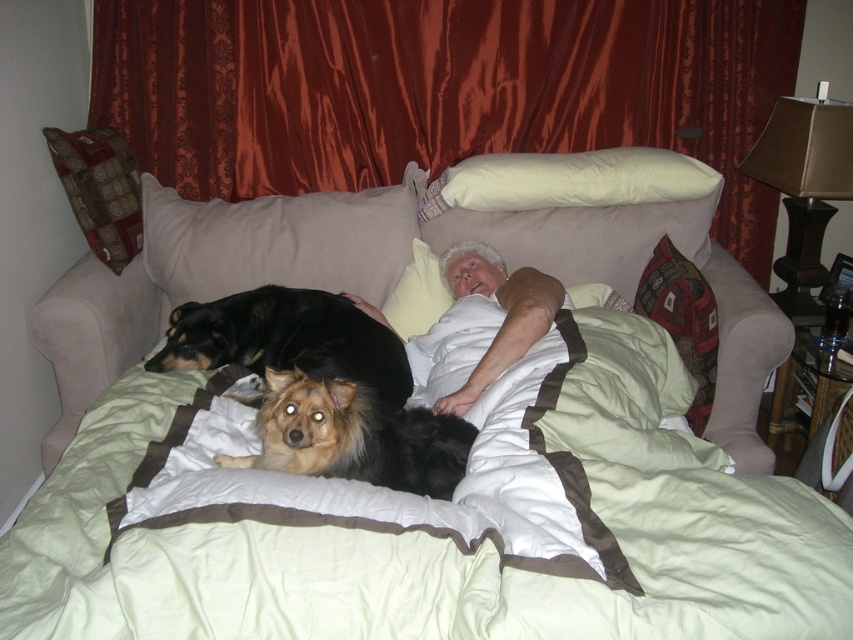
Question: Which object is the farthest from the shiny black dog at center?

Choices:
 (A) patterned fabric pillow at upper left
 (B) silky red curtain at upper center
 (C) white cotton shirt at center

Answer: (B)

Question: Is silky red curtain at upper center to the left of soft beige couch at center from the viewer's perspective?

Choices:
 (A) yes
 (B) no

Answer: (B)

Question: Which of the following is the closest to the observer?

Choices:
 (A) white soft pillow at upper center
 (B) patterned fabric pillow at upper left
 (C) beige fabric pillow at upper center
 (D) white cotton shirt at center

Answer: (D)

Question: Which point is closer to the camera taking this photo?

Choices:
 (A) (248, 228)
 (B) (427, 252)
 (C) (106, 196)
 (D) (691, 275)

Answer: (D)

Question: Considering the relative positions of white soft pillow at upper center and patterned fabric pillow at right in the image provided, where is white soft pillow at upper center located with respect to patterned fabric pillow at right?

Choices:
 (A) above
 (B) below

Answer: (A)

Question: Is beige fabric pillow at upper center to the left of patterned fabric pillow at right from the viewer's perspective?

Choices:
 (A) yes
 (B) no

Answer: (A)